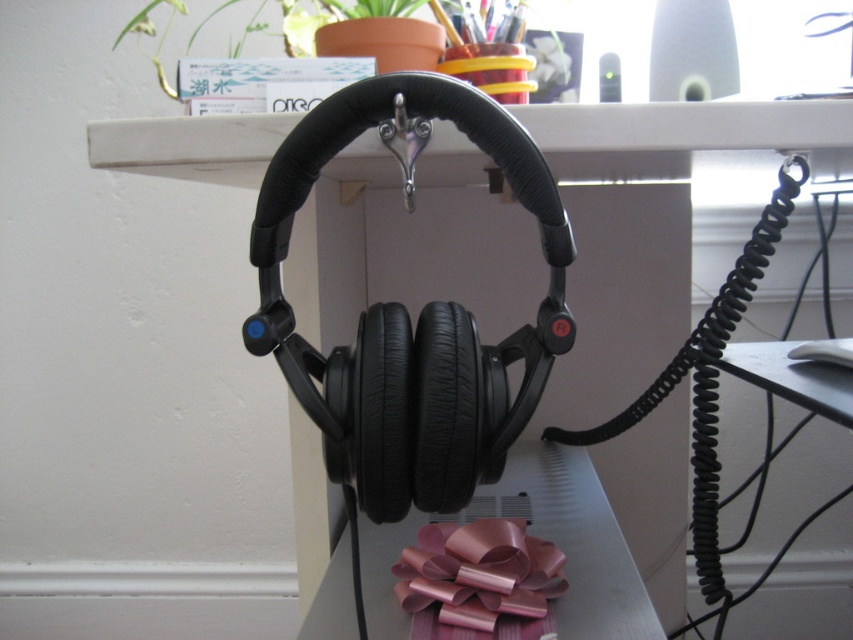
In the scene shown: Which is more to the left, metallic pink bow at lower center or pink shiny ribbon at lower center?

pink shiny ribbon at lower center is more to the left.

Between metallic pink bow at lower center and pink shiny ribbon at lower center, which one has less height?

Standing shorter between the two is pink shiny ribbon at lower center.

Who is more forward, (370, 552) or (442, 564)?

Positioned in front is point (442, 564).

Locate an element on the screen. This screenshot has height=640, width=853. metallic pink bow at lower center is located at coordinates (534, 536).